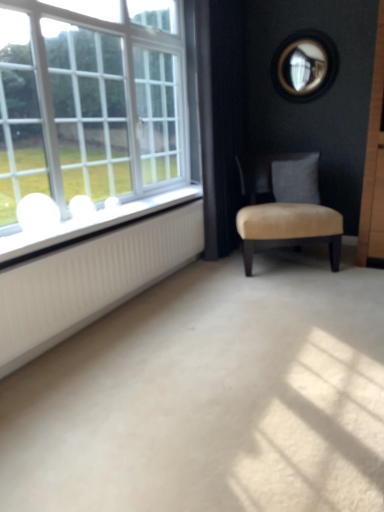
Measure the distance between white glossy window sill at left and camera.

white glossy window sill at left is 5.89 feet away from camera.

This screenshot has width=384, height=512. What do you see at coordinates (93, 112) in the screenshot? I see `white glass window at left` at bounding box center [93, 112].

You are a GUI agent. You are given a task and a screenshot of the screen. Output one action in this format:
    pyautogui.click(x=<x>, y=<y>)
    Task: Click on the suede gray pillow at center
    
    Given the screenshot: What is the action you would take?
    pyautogui.click(x=296, y=180)

From a real-world perspective, is white glossy window sill at left on beige velvet chair at center?

Correct, in the physical world, white glossy window sill at left is higher than beige velvet chair at center.

How different are the orientations of white glossy window sill at left and beige velvet chair at center in degrees?

white glossy window sill at left and beige velvet chair at center are facing 59.6 degrees away from each other.

Which of these two, white glossy window sill at left or beige velvet chair at center, is smaller?

white glossy window sill at left is smaller.

What's the angular difference between beige velvet chair at center and white glass window at left's facing directions?

The angular difference between beige velvet chair at center and white glass window at left is 59.6 degrees.

Is beige velvet chair at center shorter than white glass window at left?

Yes, beige velvet chair at center is shorter than white glass window at left.

From a real-world perspective, is beige velvet chair at center positioned above or below white glass window at left?

beige velvet chair at center is below white glass window at left.

Between beige velvet chair at center and white glass window at left, which one appears on the left side from the viewer's perspective?

Positioned to the left is white glass window at left.

Between white glass window at left and white glossy window sill at left, which one appears on the right side from the viewer's perspective?

white glossy window sill at left is more to the right.

From a real-world perspective, between white glass window at left and white glossy window sill at left, who is vertically higher?

white glass window at left is physically above.

Is white glass window at left next to white glossy window sill at left and touching it?

white glass window at left and white glossy window sill at left are not in contact.

Looking at this image, does white glass window at left come behind white glossy window sill at left?

No, it is not.

Is white glass window at left aimed at white ribbed radiator at left?

No, white glass window at left is not turned towards white ribbed radiator at left.

Which is more to the left, white glass window at left or white ribbed radiator at left?

From the viewer's perspective, white glass window at left appears more on the left side.

I want to click on window in front of the white ribbed radiator at left, so click(x=93, y=112).

Is suede gray pillow at center facing away from white glass window at left?

No, suede gray pillow at center is not facing the opposite direction of white glass window at left.

Between suede gray pillow at center and white glass window at left, which one has less height?

suede gray pillow at center.

From a real-world perspective, is suede gray pillow at center located higher than white glass window at left?

Actually, suede gray pillow at center is physically below white glass window at left in the real world.

Is white glass window at left next to beige velvet chair at center and touching it?

They are not placed beside each other.

Would you say white glass window at left is outside beige velvet chair at center?

Yes, white glass window at left is located beyond the bounds of beige velvet chair at center.

Which of these two, white glass window at left or beige velvet chair at center, is bigger?

With larger size is white glass window at left.

Is white glass window at left oriented towards beige velvet chair at center?

Yes, white glass window at left is turned towards beige velvet chair at center.

Can you tell me how much white ribbed radiator at left and white glass window at left differ in facing direction?

The angular difference between white ribbed radiator at left and white glass window at left is 0.825 degrees.

Is white ribbed radiator at left positioned in front of white glass window at left?

No, white ribbed radiator at left is further to the viewer.

Based on the photo, who is shorter, white ribbed radiator at left or white glass window at left?

Standing shorter between the two is white ribbed radiator at left.

At what (x,y) coordinates should I click in order to perform the action: click on chair lying behind the white glossy window sill at left. Please return your answer as a coordinate pair (x, y). This screenshot has width=384, height=512. Looking at the image, I should click on (285, 206).

This screenshot has width=384, height=512. I want to click on chair on the right of white glass window at left, so click(285, 206).

From the image, which object appears to be nearer to white glossy window sill at left, white glass window at left or white ribbed radiator at left?

Based on the image, white ribbed radiator at left appears to be nearer to white glossy window sill at left.

In the scene shown: When comparing their distances from white glass window at left, does beige velvet chair at center or suede gray pillow at center seem further?

suede gray pillow at center is positioned further to the anchor white glass window at left.

Considering their positions, is white ribbed radiator at left positioned further to suede gray pillow at center than beige velvet chair at center?

Among the two, white ribbed radiator at left is located further to suede gray pillow at center.

Based on their spatial positions, is beige velvet chair at center or suede gray pillow at center further from white glossy window sill at left?

The object further to white glossy window sill at left is suede gray pillow at center.

Based on their spatial positions, is white ribbed radiator at left or white glass window at left further from suede gray pillow at center?

white ribbed radiator at left lies further to suede gray pillow at center than the other object.

Looking at the image, which one is located closer to suede gray pillow at center, white glossy window sill at left or white ribbed radiator at left?

white glossy window sill at left is closer to suede gray pillow at center.

From the image, which object appears to be nearer to beige velvet chair at center, white ribbed radiator at left or suede gray pillow at center?

suede gray pillow at center lies closer to beige velvet chair at center than the other object.

Considering their positions, is suede gray pillow at center positioned further to white glass window at left than beige velvet chair at center?

Among the two, suede gray pillow at center is located further to white glass window at left.

Find the location of `window sill between white glass window at left and white ribbed radiator at left in the vertical direction`. window sill between white glass window at left and white ribbed radiator at left in the vertical direction is located at coordinates (89, 225).

Where is `window sill between white ribbed radiator at left and suede gray pillow at center from front to back`? The image size is (384, 512). window sill between white ribbed radiator at left and suede gray pillow at center from front to back is located at coordinates (89, 225).

This screenshot has width=384, height=512. Find the location of `chair between white ribbed radiator at left and suede gray pillow at center from front to back`. chair between white ribbed radiator at left and suede gray pillow at center from front to back is located at coordinates (285, 206).

Locate an element on the screen. window sill between white glass window at left and suede gray pillow at center from front to back is located at coordinates (89, 225).